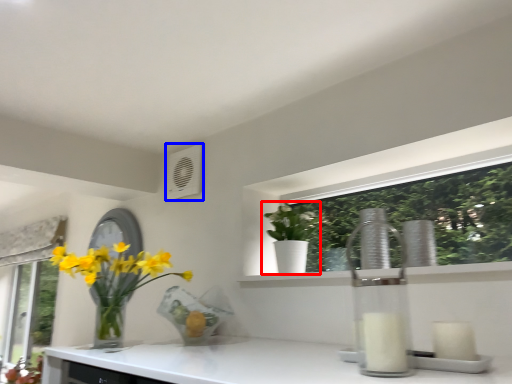
Question: Which point is closer to the camera, houseplant (highlighted by a red box) or air conditioning (highlighted by a blue box)?

Choices:
 (A) houseplant
 (B) air conditioning

Answer: (A)